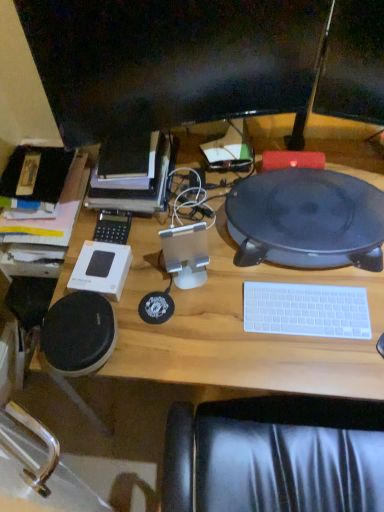
This screenshot has width=384, height=512. Find the location of `unoccupied region to the right of white plastic keyboard at lower right`. unoccupied region to the right of white plastic keyboard at lower right is located at coordinates (360, 298).